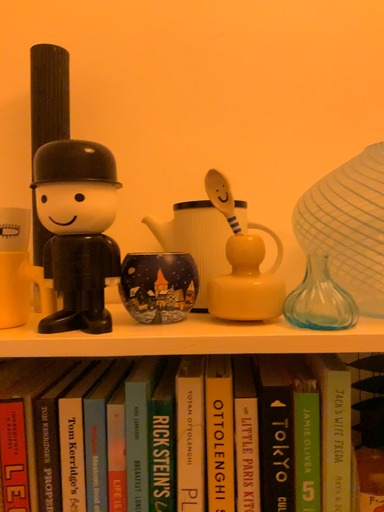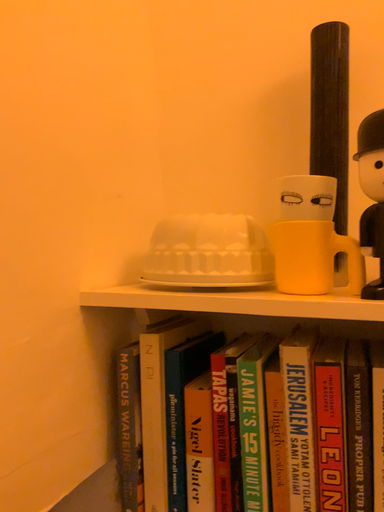
Question: How did the camera likely rotate when shooting the video?

Choices:
 (A) rotated left
 (B) rotated right

Answer: (A)